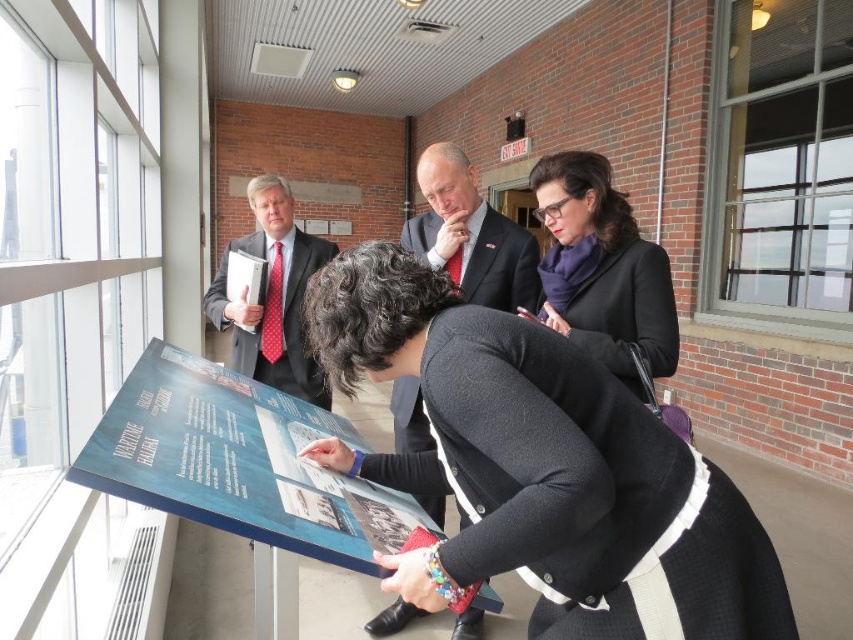
Based on the photo, which is more to the left, black wool coat at center or purple scarf at upper right?

From the viewer's perspective, black wool coat at center appears more on the left side.

Is black wool coat at center thinner than purple scarf at upper right?

No, black wool coat at center is not thinner than purple scarf at upper right.

Who is more forward, (x=635, y=632) or (x=589, y=340)?

Positioned in front is point (x=635, y=632).

Locate an element on the screen. black wool coat at center is located at coordinates [x=541, y=467].

Does blue glossy poster at lower left appear under purple scarf at upper right?

Yes.

Is blue glossy poster at lower left smaller than purple scarf at upper right?

No, blue glossy poster at lower left is not smaller than purple scarf at upper right.

Is point (265, 490) positioned behind point (569, 248)?

No.

Image resolution: width=853 pixels, height=640 pixels. In order to click on blue glossy poster at lower left in this screenshot , I will do `click(218, 454)`.

Is black wool coat at center further to the viewer compared to matte black suit at center?

No, it is in front of matte black suit at center.

Which is more to the right, black wool coat at center or matte black suit at center?

matte black suit at center is more to the right.

Locate an element on the screen. black wool coat at center is located at coordinates (541, 467).

The width and height of the screenshot is (853, 640). Identify the location of black wool coat at center. (541, 467).